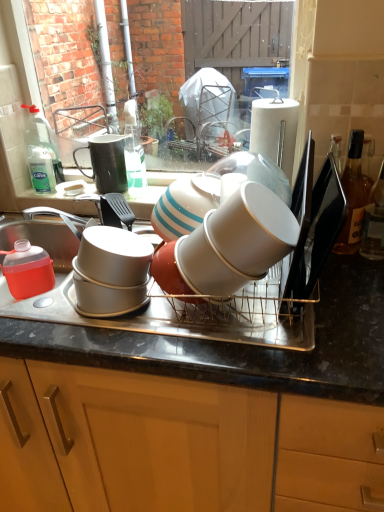
Where is `free space in front of translucent glass bottle at right, marked as the second bottle in a left-to-right arrangement`? free space in front of translucent glass bottle at right, marked as the second bottle in a left-to-right arrangement is located at coordinates (359, 284).